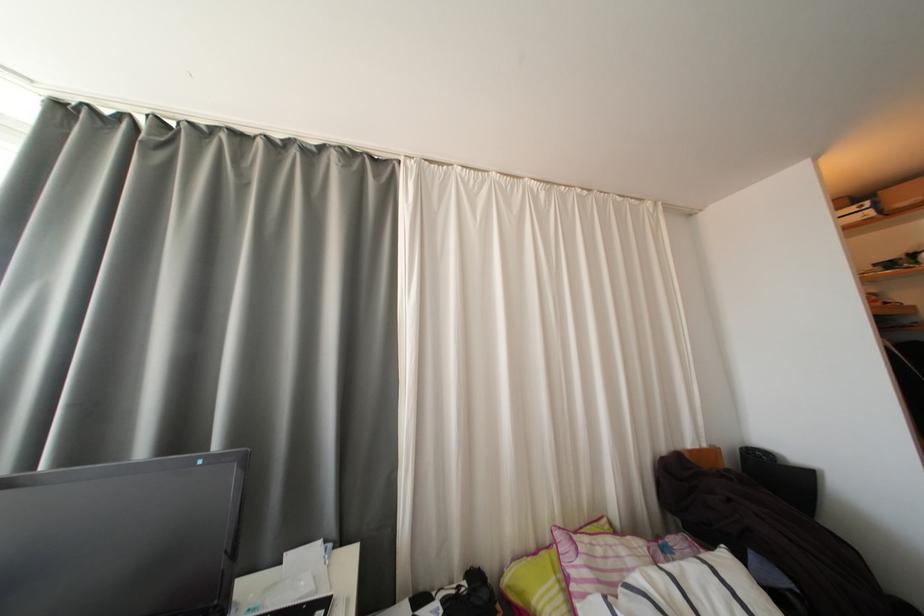
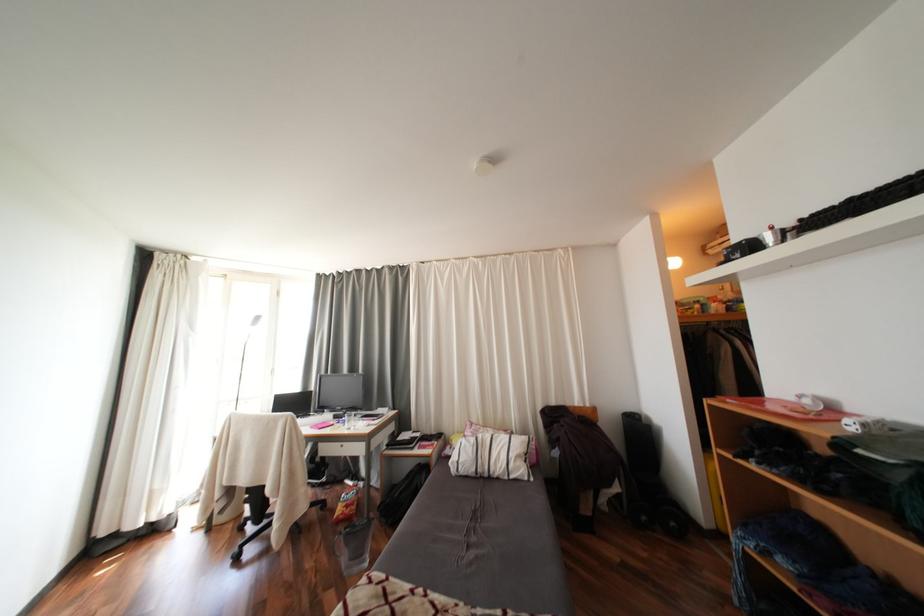
The images are taken continuously from a first-person perspective. In which direction are you moving?

The cameraman walked toward right, backward.